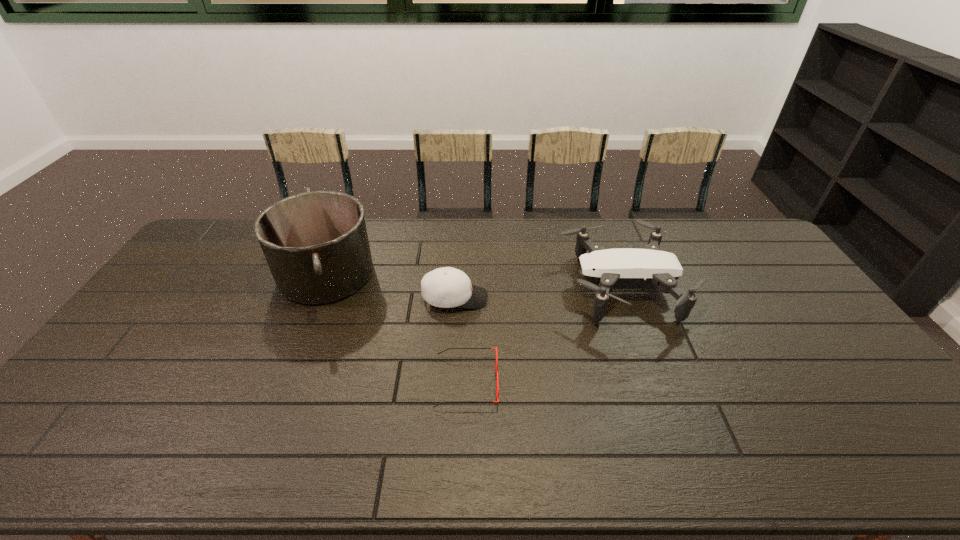
This screenshot has width=960, height=540. I want to click on vacant space positioned 0.290m on the camera side of the second tallest object, so click(473, 288).

The width and height of the screenshot is (960, 540). Identify the location of vacant space positioned 0.130m on the front-facing side of the second shortest object. (529, 298).

Locate an element on the screen. The image size is (960, 540). vacant area situated on the front-facing side of the spectacles is located at coordinates (600, 382).

At what (x,y) coordinates should I click in order to perform the action: click on pan present at the far edge. Please return your answer as a coordinate pair (x, y). The image size is (960, 540). Looking at the image, I should click on (316, 245).

Identify the location of drone at the far edge. The width and height of the screenshot is (960, 540). (604, 269).

This screenshot has width=960, height=540. In order to click on vacant region at the far edge in this screenshot , I will do `click(551, 227)`.

I want to click on free spot at the near edge of the desktop, so click(744, 461).

In the image, there is a desktop. At what (x,y) coordinates should I click in order to perform the action: click on free space at the right edge. Please return your answer as a coordinate pair (x, y). This screenshot has height=540, width=960. Looking at the image, I should click on (856, 403).

Image resolution: width=960 pixels, height=540 pixels. What are the coordinates of `vacant space at the far right corner` in the screenshot? It's located at (728, 240).

You are a GUI agent. You are given a task and a screenshot of the screen. Output one action in this format:
    pyautogui.click(x=<x>, y=<y>)
    Task: Click on the vacant area that lies between the baseball cap and the rightmost object
    Image resolution: width=960 pixels, height=540 pixels.
    Given the screenshot: What is the action you would take?
    pyautogui.click(x=539, y=293)